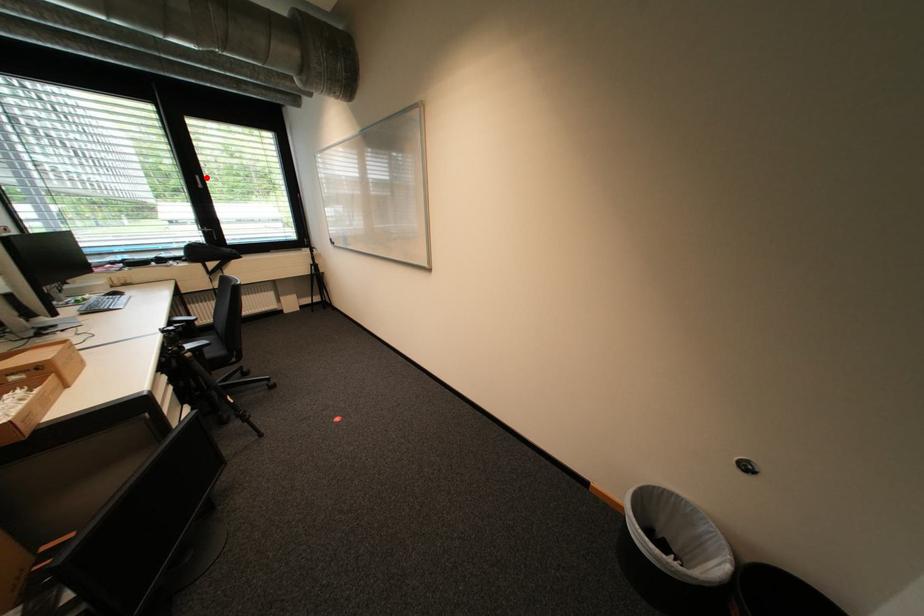
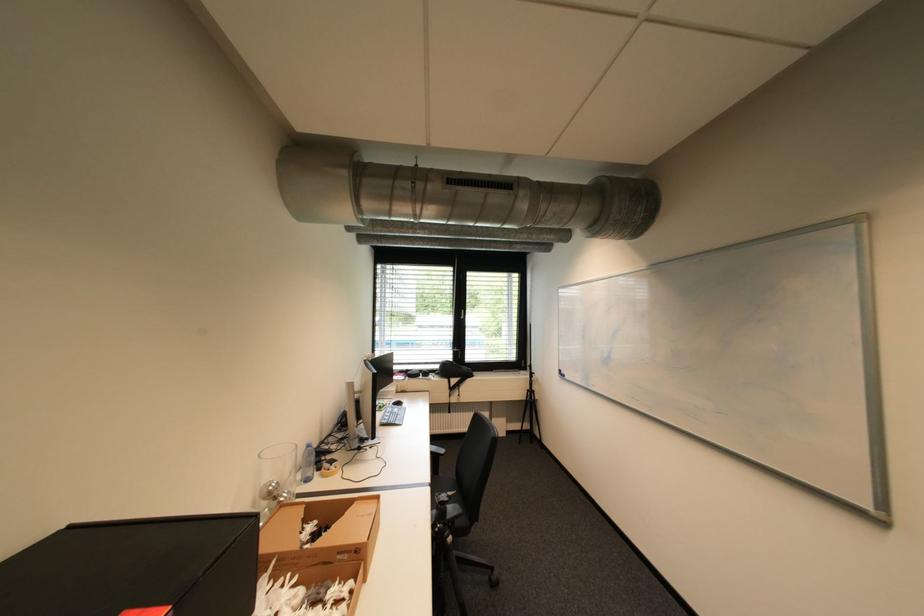
Where in the second image is the point corresponding to the highlighted location from the first image?

(470, 312)